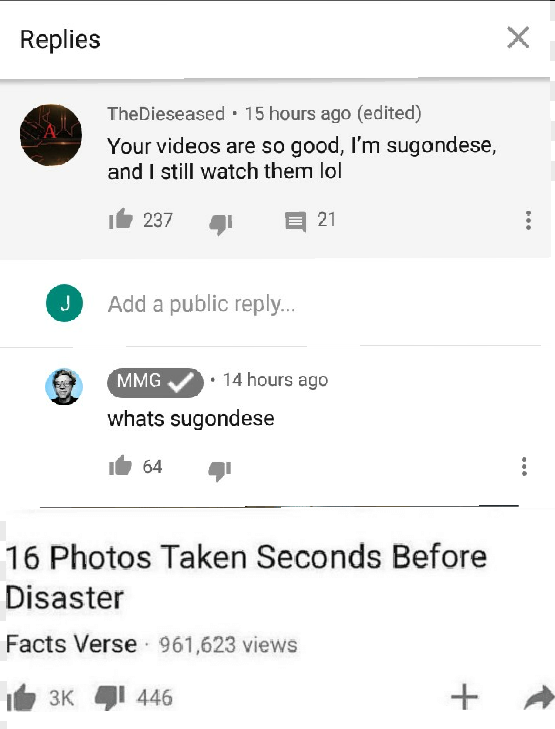
The width and height of the screenshot is (555, 729). Find the location of `comment input box`. comment input box is located at coordinates (225, 304).